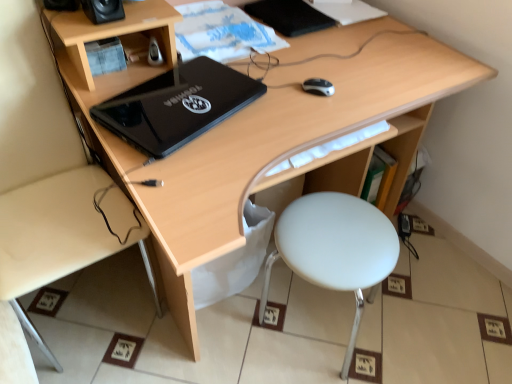
Where is `free space in front of black plastic speaker at upper left, the 2th speaker from the right`? free space in front of black plastic speaker at upper left, the 2th speaker from the right is located at coordinates (69, 24).